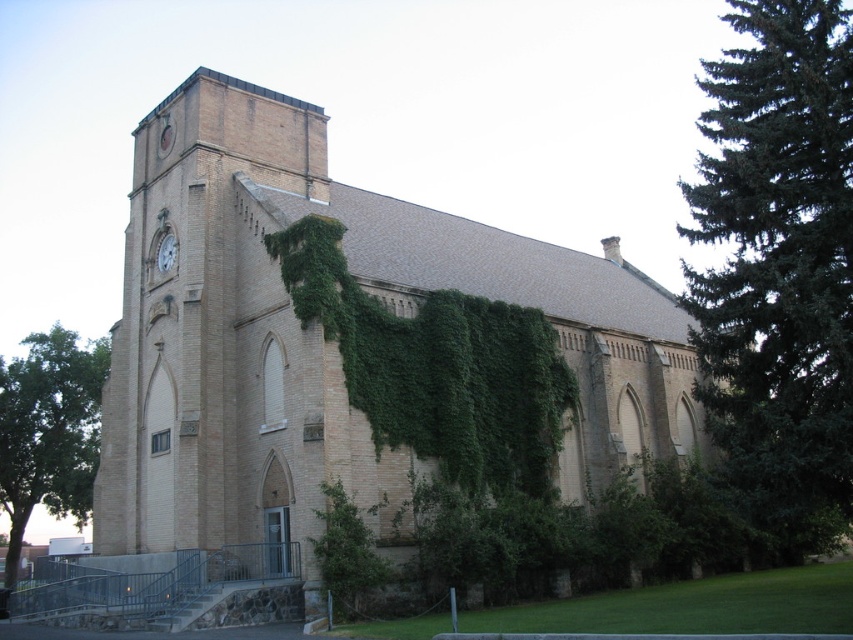
Is brown brick church at center positioned behind green leafy tree at lower left?

No.

Is point (468, 250) positioned in front of point (70, 344)?

That is True.

Image resolution: width=853 pixels, height=640 pixels. What do you see at coordinates (322, 333) in the screenshot?
I see `brown brick church at center` at bounding box center [322, 333].

You are a GUI agent. You are given a task and a screenshot of the screen. Output one action in this format:
    pyautogui.click(x=<x>, y=<y>)
    Task: Click on the brown brick church at center
    
    Given the screenshot: What is the action you would take?
    [322, 333]

Does green needle-like at right appear on the right side of green leafy tree at lower left?

Yes, green needle-like at right is to the right of green leafy tree at lower left.

Find the location of `green needle-like at right`. green needle-like at right is located at coordinates (778, 257).

Find the location of a particular element. This screenshot has height=640, width=853. green needle-like at right is located at coordinates (778, 257).

Is brown brick church at center positioned behind green needle-like at right?

Yes, it is.

Who is more forward, (x=665, y=304) or (x=746, y=232)?

Point (x=746, y=232) is more forward.

This screenshot has height=640, width=853. I want to click on brown brick church at center, so click(x=322, y=333).

Locate an element on the screen. brown brick church at center is located at coordinates (322, 333).